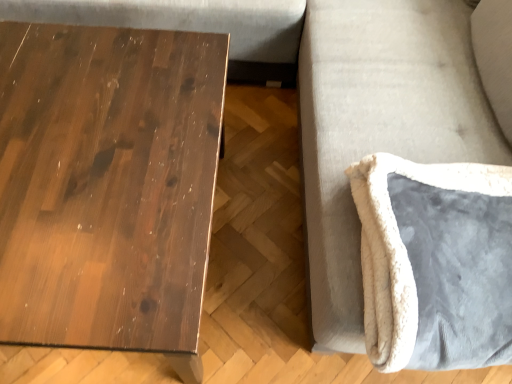
Question: Is velvet gray swivel chair at right far from white plush cushion at lower right?

Choices:
 (A) yes
 (B) no

Answer: (B)

Question: Is velvet gray swivel chair at right to the right of white plush cushion at lower right from the viewer's perspective?

Choices:
 (A) no
 (B) yes

Answer: (A)

Question: From the image's perspective, is velvet gray swivel chair at right on top of white plush cushion at lower right?

Choices:
 (A) no
 (B) yes

Answer: (A)

Question: Could you tell me if velvet gray swivel chair at right is facing white plush cushion at lower right?

Choices:
 (A) yes
 (B) no

Answer: (A)

Question: Can you confirm if velvet gray swivel chair at right is shorter than white plush cushion at lower right?

Choices:
 (A) no
 (B) yes

Answer: (B)

Question: From the image's perspective, relative to dark wood table at left, is velvet gray swivel chair at right above or below?

Choices:
 (A) above
 (B) below

Answer: (B)

Question: Is velvet gray swivel chair at right spatially inside dark wood table at left, or outside of it?

Choices:
 (A) inside
 (B) outside

Answer: (B)

Question: Based on their sizes in the image, would you say velvet gray swivel chair at right is bigger or smaller than dark wood table at left?

Choices:
 (A) big
 (B) small

Answer: (B)

Question: Is velvet gray swivel chair at right taller or shorter than dark wood table at left?

Choices:
 (A) short
 (B) tall

Answer: (A)

Question: Is dark wood table at left wider or thinner than white plush cushion at lower right?

Choices:
 (A) wide
 (B) thin

Answer: (A)

Question: From a real-world perspective, is dark wood table at left physically located above or below white plush cushion at lower right?

Choices:
 (A) below
 (B) above

Answer: (A)

Question: Visually, is dark wood table at left positioned to the left or to the right of white plush cushion at lower right?

Choices:
 (A) right
 (B) left

Answer: (B)

Question: Is point (68, 307) positioned closer to the camera than point (337, 208)?

Choices:
 (A) farther
 (B) closer

Answer: (B)

Question: From the image's perspective, is dark wood table at left located above or below velvet gray swivel chair at right?

Choices:
 (A) above
 (B) below

Answer: (A)

Question: Considering the positions of dark wood table at left and velvet gray swivel chair at right in the image, is dark wood table at left taller or shorter than velvet gray swivel chair at right?

Choices:
 (A) short
 (B) tall

Answer: (B)